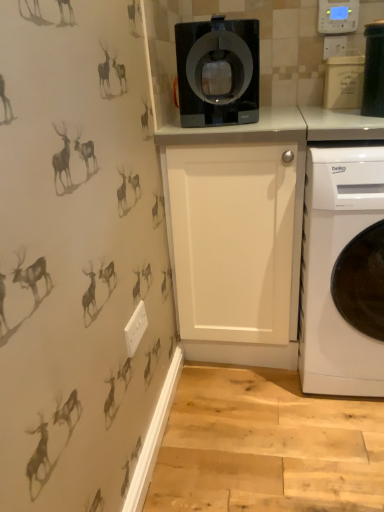
Image resolution: width=384 pixels, height=512 pixels. Find the location of `empty space that is to the right of black glossy coffee machine at upper center`. empty space that is to the right of black glossy coffee machine at upper center is located at coordinates (273, 119).